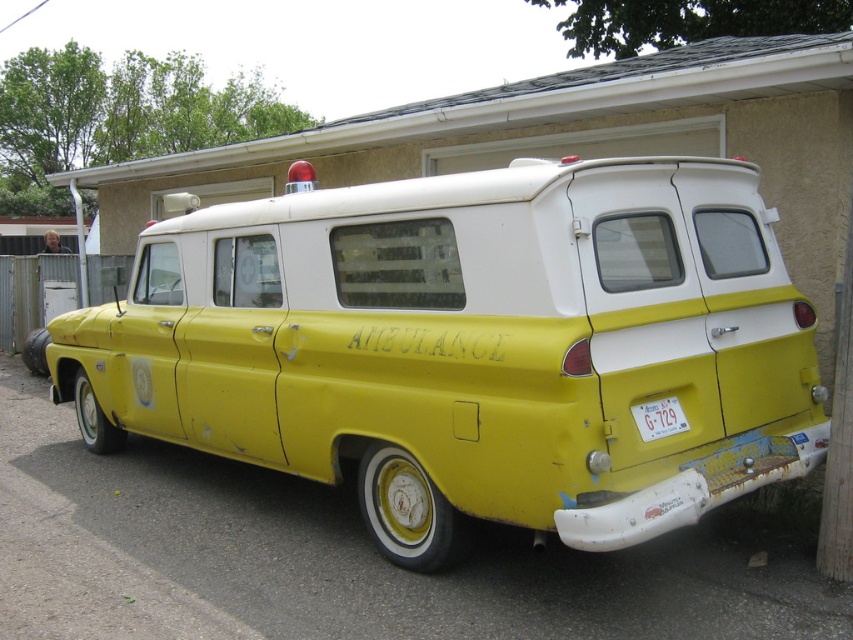
Which of these two, yellow matte van at center or white plastic license plate at rear, stands taller?

Standing taller between the two is yellow matte van at center.

Is yellow matte van at center smaller than white plastic license plate at rear?

No.

The height and width of the screenshot is (640, 853). I want to click on yellow matte van at center, so click(469, 346).